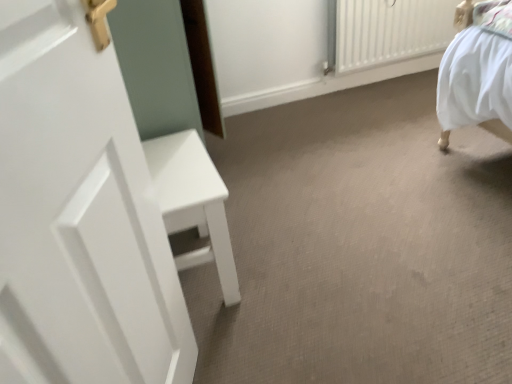
In order to face white textured radiator at upper right, should I rotate leftwards or rightwards?

Rotate your view right by about 21.514°.

Describe the element at coordinates (389, 31) in the screenshot. I see `white textured radiator at upper right` at that location.

You are a GUI agent. You are given a task and a screenshot of the screen. Output one action in this format:
    pyautogui.click(x=<x>, y=<y>)
    Task: Click on the white textured radiator at upper right
    Image resolution: width=512 pixels, height=384 pixels.
    Given the screenshot: What is the action you would take?
    pyautogui.click(x=389, y=31)

What is the approximate height of white matte door at left?

3.44 feet.

Measure the distance between white matte door at left and camera.

white matte door at left and camera are 43.85 centimeters apart.

Describe the element at coordinates (79, 216) in the screenshot. The image size is (512, 384). I see `white matte door at left` at that location.

Where is `white matte door at left`? The height and width of the screenshot is (384, 512). white matte door at left is located at coordinates (79, 216).

Where is `white textured radiator at upper right`? The height and width of the screenshot is (384, 512). white textured radiator at upper right is located at coordinates (389, 31).

Which object is positioned more to the left, white textured radiator at upper right or white matte door at left?

white matte door at left is more to the left.

Which object is closer to the camera, white textured radiator at upper right or white matte door at left?

white matte door at left is closer to the camera.

Does point (433, 47) come farther from viewer compared to point (102, 271)?

Yes, point (433, 47) is farther from viewer.

From the image's perspective, is white textured radiator at upper right above or below white matte door at left?

Clearly, from the image's perspective, white textured radiator at upper right is above white matte door at left.

From a real-world perspective, which is physically above, white textured radiator at upper right or white matte door at left?

From a 3D spatial view, white matte door at left is above.

Between white textured radiator at upper right and white matte door at left, which one has larger width?

With larger width is white textured radiator at upper right.

Who is taller, white textured radiator at upper right or white matte door at left?

Standing taller between the two is white matte door at left.

Considering the relative sizes of white textured radiator at upper right and white matte door at left in the image provided, is white textured radiator at upper right smaller than white matte door at left?

Actually, white textured radiator at upper right might be larger than white matte door at left.

Could white matte door at left be considered to be inside white textured radiator at upper right?

No, white textured radiator at upper right does not contain white matte door at left.

Would you say white textured radiator at upper right is a long distance from white matte door at left?

white textured radiator at upper right is far away from white matte door at left.

Is white textured radiator at upper right positioned with its back to white matte door at left?

No, white matte door at left is not at the back of white textured radiator at upper right.

Image resolution: width=512 pixels, height=384 pixels. What are the coordinates of `radiator located underneath the white matte door at left (from a real-world perspective)` in the screenshot? It's located at tap(389, 31).

Is white matte door at left at the left side of white textured radiator at upper right?

Yes, white matte door at left is to the left of white textured radiator at upper right.

Is white matte door at left behind white textured radiator at upper right?

No.

In the scene shown: Which is nearer, (112, 329) or (383, 10)?

Point (112, 329).

From the image's perspective, which one is positioned higher, white matte door at left or white textured radiator at upper right?

white textured radiator at upper right.

From a real-world perspective, is white matte door at left over white textured radiator at upper right?

Indeed, from a real-world perspective, white matte door at left stands above white textured radiator at upper right.

Considering the sizes of objects white matte door at left and white textured radiator at upper right in the image provided, who is wider, white matte door at left or white textured radiator at upper right?

Wider between the two is white textured radiator at upper right.

Who is taller, white matte door at left or white textured radiator at upper right?

white matte door at left.

Based on their sizes in the image, would you say white matte door at left is bigger or smaller than white textured radiator at upper right?

Clearly, white matte door at left is smaller in size than white textured radiator at upper right.

Is white matte door at left located outside white textured radiator at upper right?

Yes, white matte door at left is outside of white textured radiator at upper right.

Are white matte door at left and white textured radiator at upper right far apart?

Indeed, white matte door at left is not near white textured radiator at upper right.

Is white matte door at left aimed at white textured radiator at upper right?

No, white matte door at left is not oriented towards white textured radiator at upper right.

Find the location of a particular element. door positioned vertically above the white textured radiator at upper right (from a real-world perspective) is located at coordinates 79,216.

Where is `radiator above the white matte door at left (from the image's perspective)`? This screenshot has width=512, height=384. radiator above the white matte door at left (from the image's perspective) is located at coordinates (389, 31).

The height and width of the screenshot is (384, 512). Find the location of `radiator that appears on the right of white matte door at left`. radiator that appears on the right of white matte door at left is located at coordinates (389, 31).